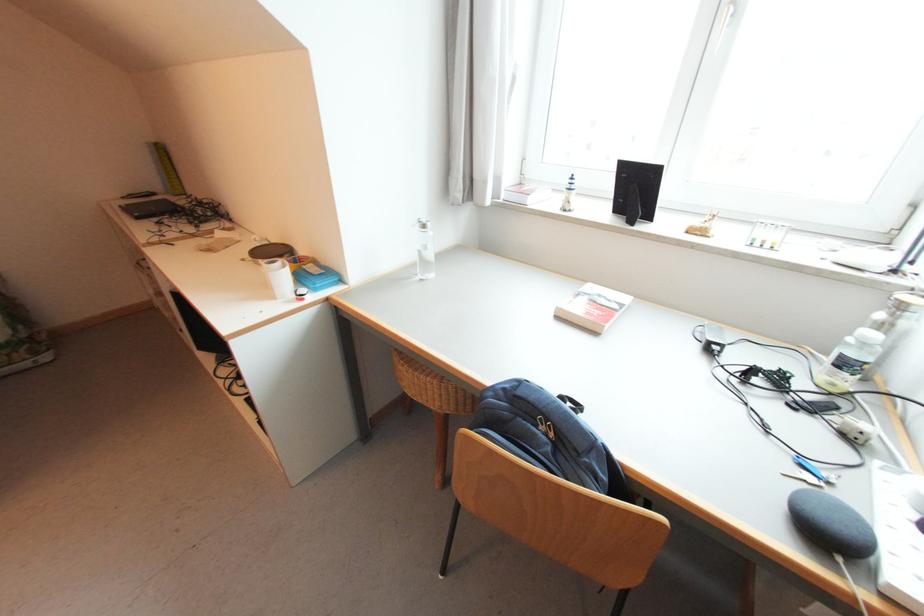
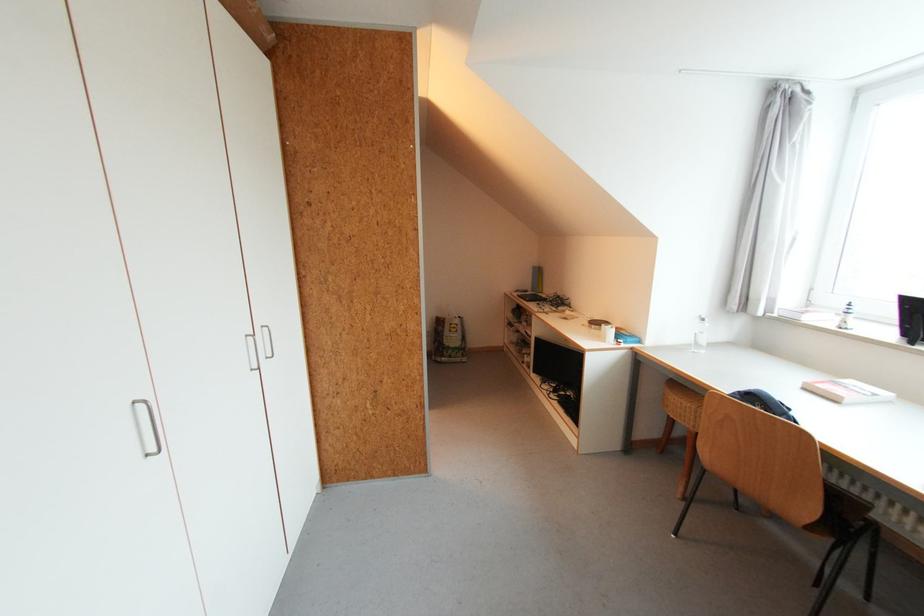
Where in the second image is the point corresponding to [423,225] from the first image?

(703, 320)